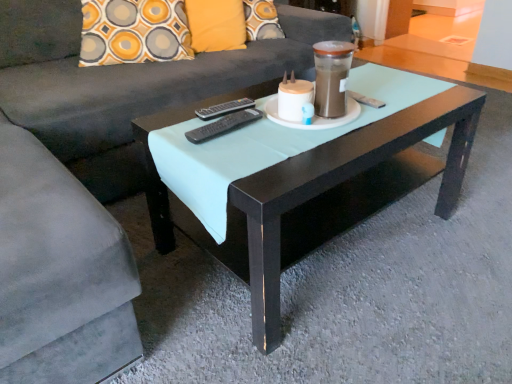
Locate an element on the screen. Image resolution: width=512 pixels, height=384 pixels. free space in front of black plastic remote at center, which is counted as the second remote, starting from the back is located at coordinates (237, 154).